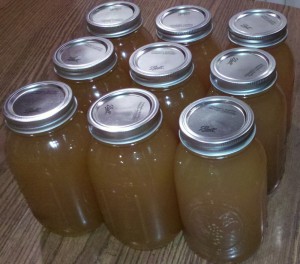
The height and width of the screenshot is (264, 300). I want to click on top row of jars, so click(136, 36), click(204, 48), click(283, 49).